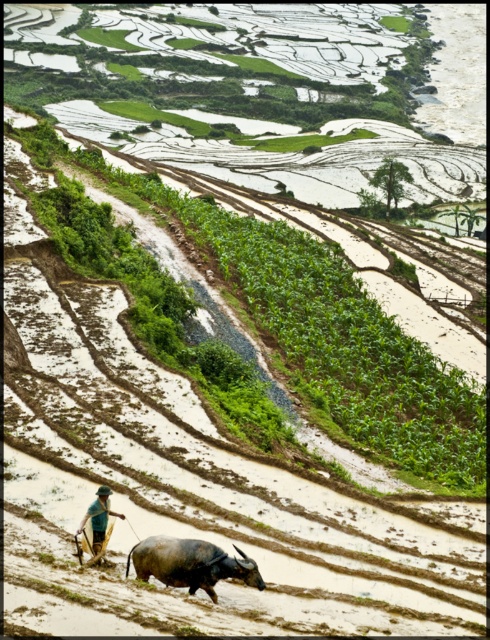
You are standing at the edge of the terraced rice paddies and see the dark gray textured bull at lower center and the green fabric hat at lower center. Which object is positioned to the right of the other?

The dark gray textured bull at lower center is to the right of the green fabric hat at lower center.

You are a farmer standing in the middle of the terraced rice paddies. You notice a dark gray textured bull at lower center and a green fabric hat at lower center. Which object is taller?

The green fabric hat at lower center is taller than the dark gray textured bull at lower center.